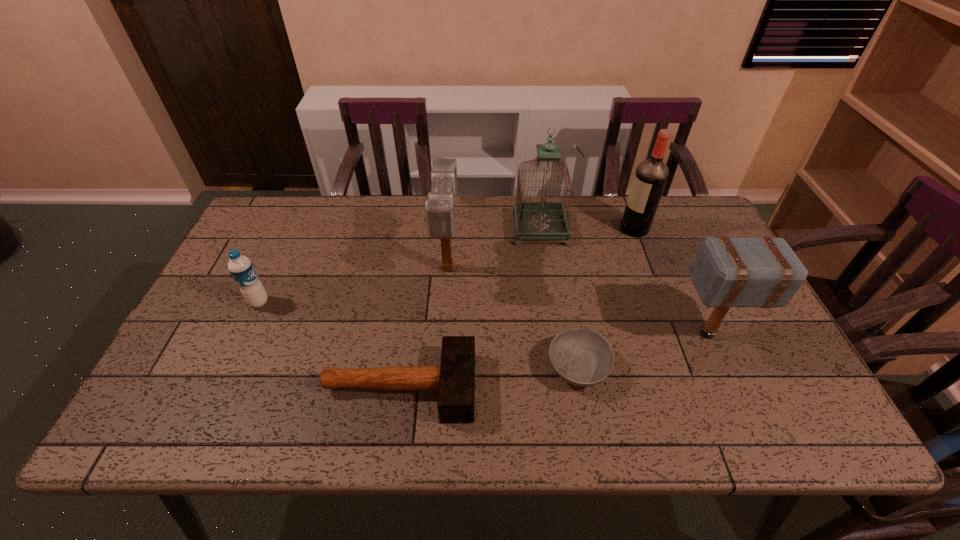
I want to click on free location at the right edge, so click(x=682, y=260).

The width and height of the screenshot is (960, 540). Identify the location of free space at the near left corner of the desktop. (181, 428).

This screenshot has width=960, height=540. I want to click on vacant region between the bowl and the fifth tallest object, so click(x=419, y=335).

The width and height of the screenshot is (960, 540). I want to click on free space that is in between the shortest mallet and the farthest mallet, so click(423, 327).

Locate an element on the screen. Image resolution: width=960 pixels, height=540 pixels. blank region between the birdcage and the fifth tallest object is located at coordinates (399, 266).

At what (x,y) coordinates should I click in order to perform the action: click on free space that is in between the farthest mallet and the liquor. Please return your answer as a coordinate pair (x, y). The image size is (960, 540). Looking at the image, I should click on (541, 248).

Where is `vacant space in between the liquor and the farthest mallet`? The height and width of the screenshot is (540, 960). vacant space in between the liquor and the farthest mallet is located at coordinates (541, 248).

Where is `empty space between the sixth tallest object and the shortest object`? empty space between the sixth tallest object and the shortest object is located at coordinates (489, 377).

Locate an element on the screen. The image size is (960, 540). free space between the sixth tallest object and the leftmost object is located at coordinates (329, 345).

The image size is (960, 540). I want to click on free spot between the fifth tallest object and the shortest object, so click(x=419, y=335).